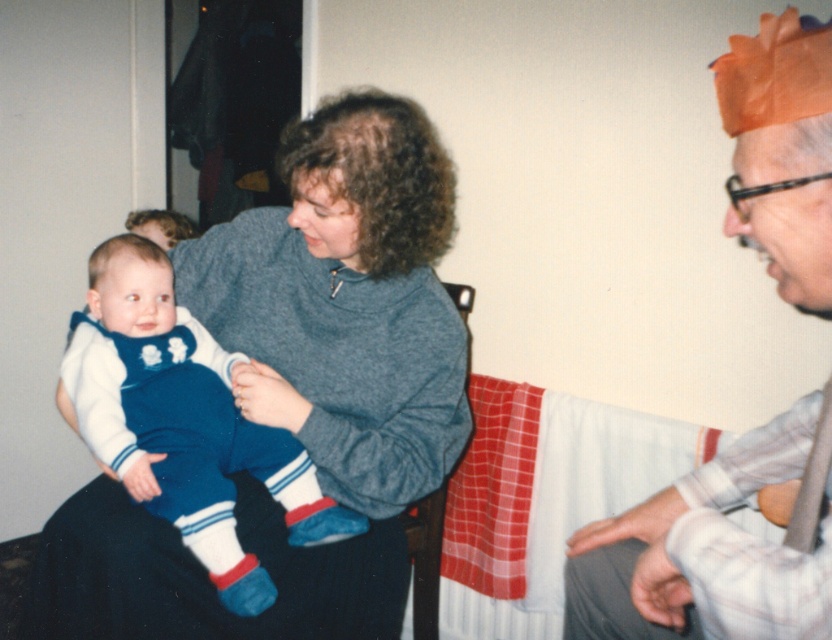
Is matte gray shirt at right positioned before velvet blue jumpsuit at center?

Yes, it is in front of velvet blue jumpsuit at center.

Measure the distance between point (632, 513) and camera.

Point (632, 513) and camera are 1.19 meters apart from each other.

Is point (800, 529) in front of point (236, 556)?

Yes, it is in front of point (236, 556).

What are the coordinates of `matte gray shirt at right` in the screenshot? It's located at (714, 547).